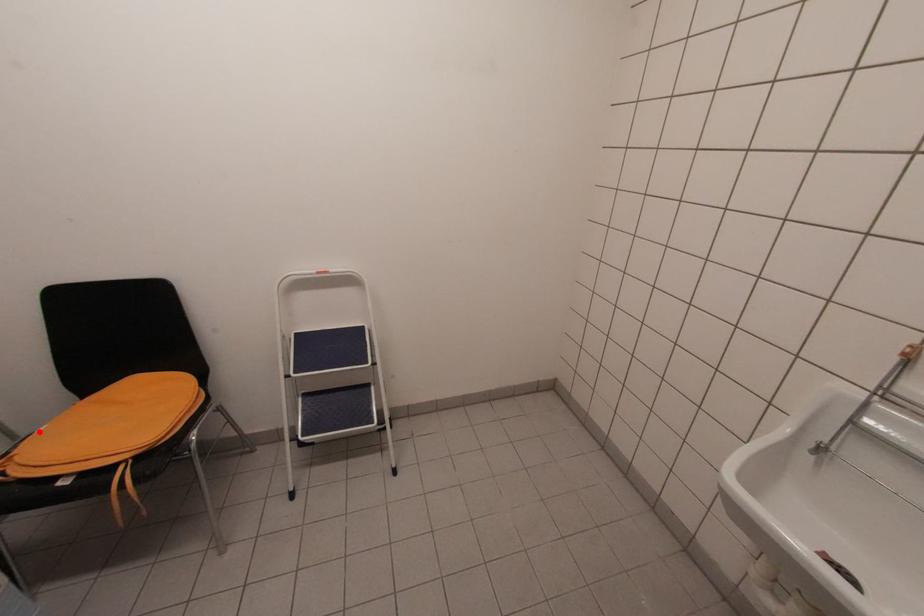
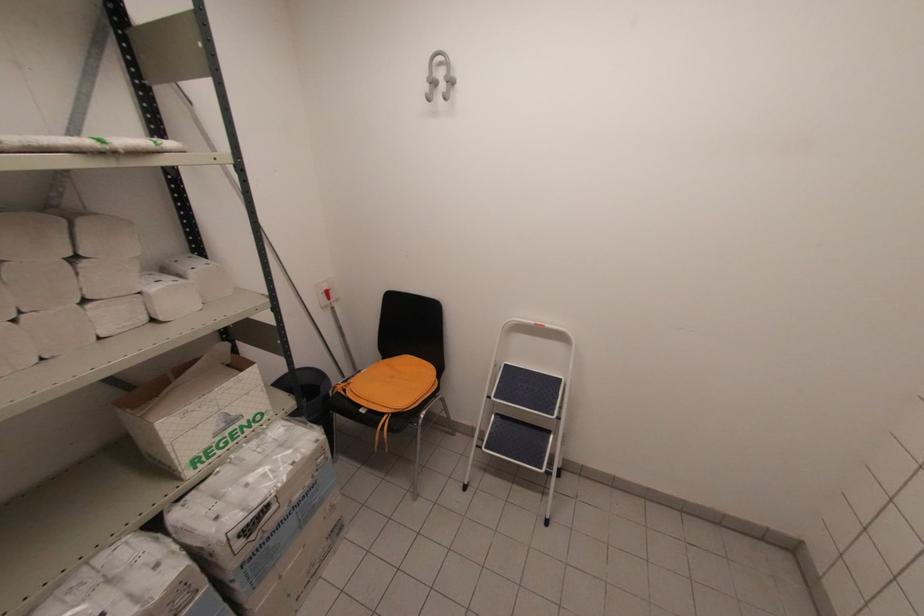
Find the pixel in the second image that matches the highlighted location in the first image.

(362, 371)